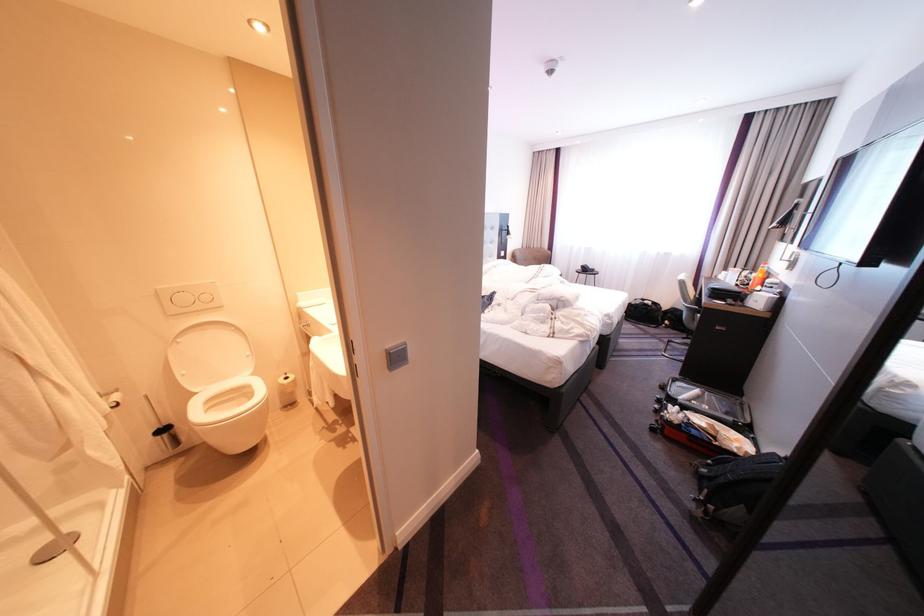
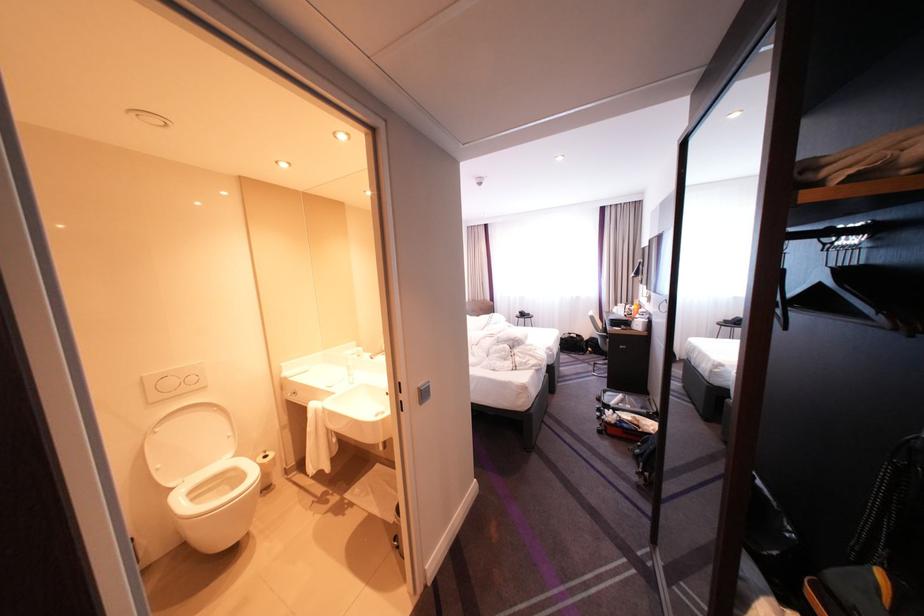
In the second image, find the point that corresponds to point (756, 270) in the first image.

(638, 305)